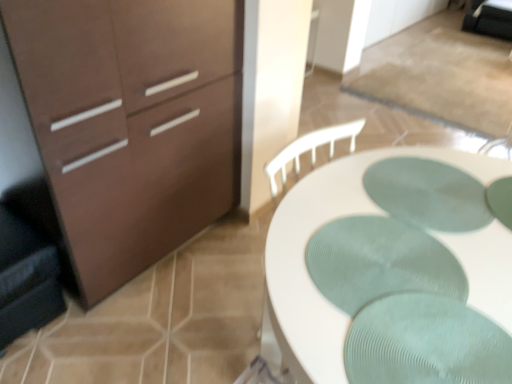
Question: Can you confirm if white textured desk at center is positioned to the right of green ribbed placemat at center, arranged as the 1th oval when viewed from the front?

Choices:
 (A) no
 (B) yes

Answer: (B)

Question: Does white textured desk at center turn towards green ribbed placemat at center, which is the 2th oval in back-to-front order?

Choices:
 (A) no
 (B) yes

Answer: (A)

Question: Is white textured desk at center positioned with its back to green ribbed placemat at center, the 1th oval positioned from the bottom?

Choices:
 (A) yes
 (B) no

Answer: (B)

Question: Is white textured desk at center shorter than green ribbed placemat at center, which is the 2th oval in back-to-front order?

Choices:
 (A) no
 (B) yes

Answer: (A)

Question: Can you confirm if white textured desk at center is wider than green ribbed placemat at center, arranged as the 1th oval when viewed from the front?

Choices:
 (A) yes
 (B) no

Answer: (A)

Question: In the image, is green ribbed placemat at center, the second oval from the top, on the left side or the right side of dark gray fabric swivel chair at left?

Choices:
 (A) right
 (B) left

Answer: (A)

Question: From the image's perspective, relative to dark gray fabric swivel chair at left, is green ribbed placemat at center, the 1th oval positioned from the bottom, above or below?

Choices:
 (A) above
 (B) below

Answer: (A)

Question: From a real-world perspective, relative to dark gray fabric swivel chair at left, is green ribbed placemat at center, arranged as the 1th oval when viewed from the front, vertically above or below?

Choices:
 (A) below
 (B) above

Answer: (B)

Question: Is green ribbed placemat at center, the 1th oval positioned from the bottom, taller or shorter than dark gray fabric swivel chair at left?

Choices:
 (A) short
 (B) tall

Answer: (A)

Question: Is point 54,268 closer or farther from the camera than point 136,127?

Choices:
 (A) farther
 (B) closer

Answer: (A)

Question: From a real-world perspective, is dark gray fabric swivel chair at left physically located above or below matte brown cabinet at left?

Choices:
 (A) below
 (B) above

Answer: (A)

Question: Is dark gray fabric swivel chair at left inside or outside of matte brown cabinet at left?

Choices:
 (A) outside
 (B) inside

Answer: (A)

Question: Is dark gray fabric swivel chair at left bigger or smaller than matte brown cabinet at left?

Choices:
 (A) small
 (B) big

Answer: (A)

Question: In terms of size, does matte brown cabinet at left appear bigger or smaller than green textured placemat at center, positioned as the first oval in back-to-front order?

Choices:
 (A) big
 (B) small

Answer: (A)

Question: Which is correct: matte brown cabinet at left is inside green textured placemat at center, the 2th oval viewed from the front, or outside of it?

Choices:
 (A) outside
 (B) inside

Answer: (A)